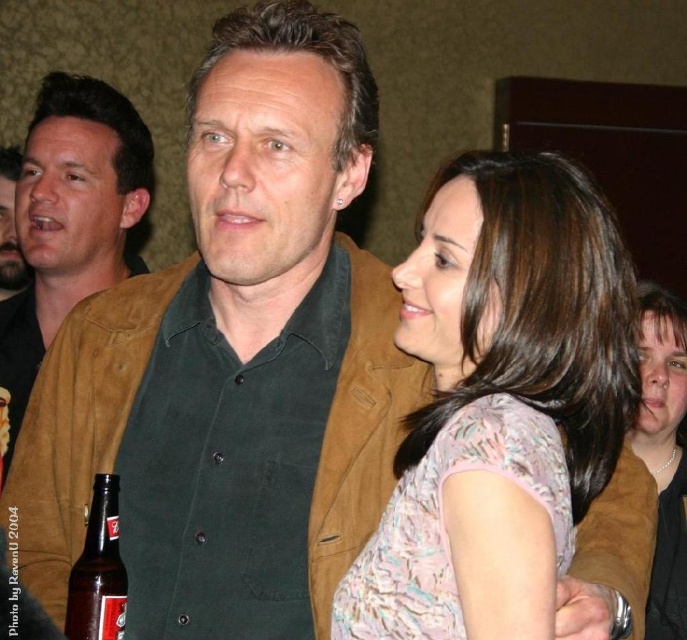
Does matte pink floral blouse at center appear on the left side of brown leather jacket at center?

In fact, matte pink floral blouse at center is to the right of brown leather jacket at center.

Is matte pink floral blouse at center above brown leather jacket at center?

No, matte pink floral blouse at center is not above brown leather jacket at center.

Where is `matte pink floral blouse at center`? matte pink floral blouse at center is located at coordinates (502, 404).

Image resolution: width=687 pixels, height=640 pixels. What are the coordinates of `matte pink floral blouse at center` in the screenshot? It's located at [x=502, y=404].

Does matte pink floral blouse at center have a lesser height compared to brown glass bottle at lower left?

In fact, matte pink floral blouse at center may be taller than brown glass bottle at lower left.

Find the location of a particular element. This screenshot has width=687, height=640. matte pink floral blouse at center is located at coordinates (502, 404).

Is brown leather jacket at center smaller than brown glass bottle at lower left?

No.

Is point (131, 166) positioned in front of point (111, 602)?

That is False.

Locate an element on the screen. This screenshot has height=640, width=687. brown leather jacket at center is located at coordinates (69, 218).